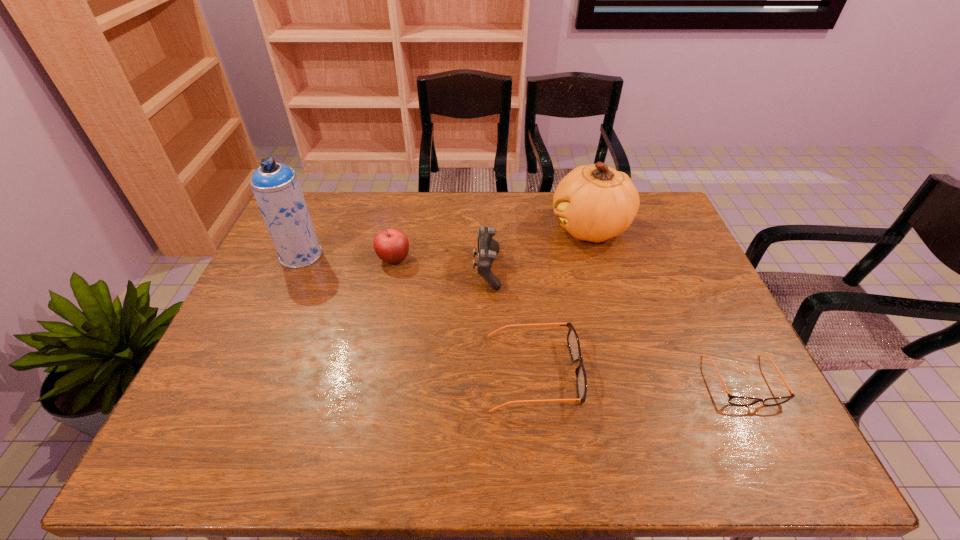
Please point a free position for a spectacles on the left. Please provide its 2D coordinates. Your answer should be formatted as a tuple, i.e. [(x, y)], where the tuple contains the x and y coordinates of a point satisfying the conditions above.

[(331, 364)]